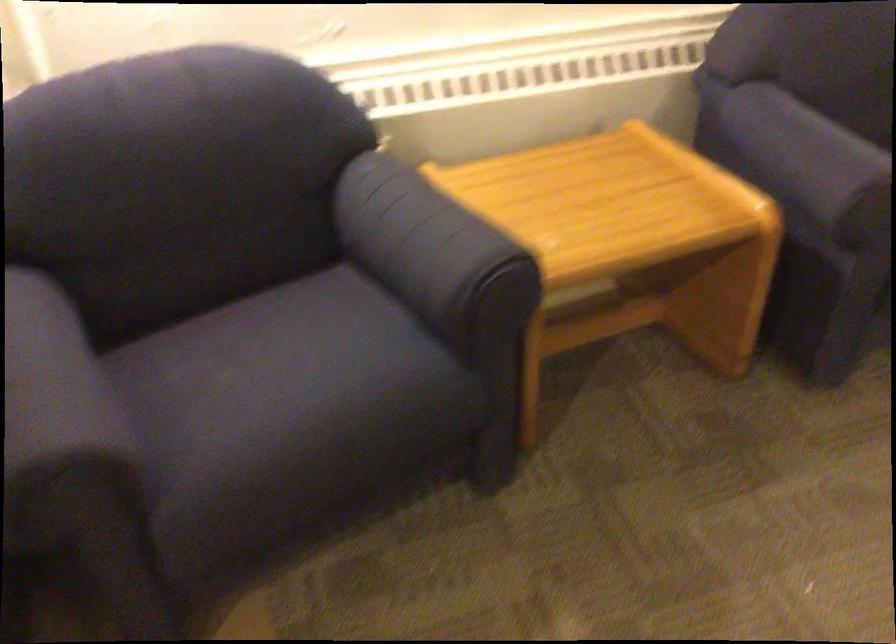
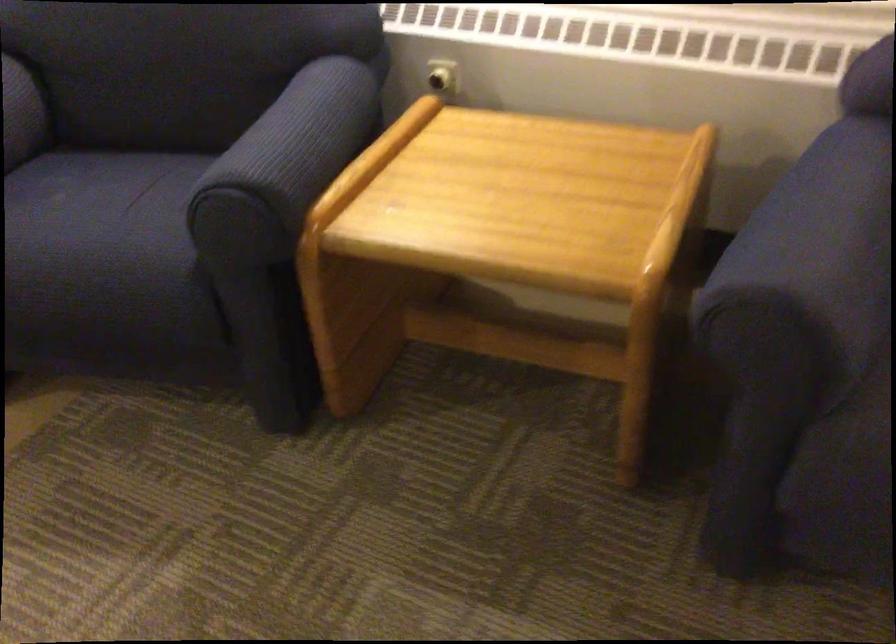
Find the pixel in the second image that matches (472,218) in the first image.

(295, 144)